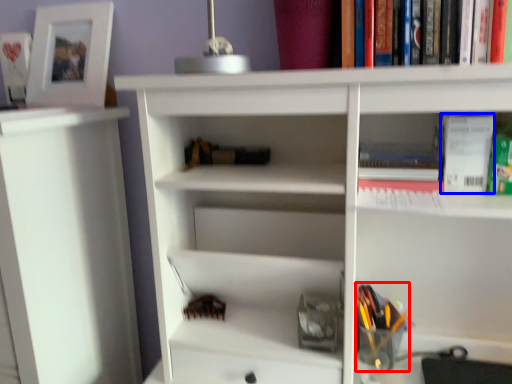
Question: Which object is further to the camera taking this photo, stationery (highlighted by a red box) or paperback book (highlighted by a blue box)?

Choices:
 (A) stationery
 (B) paperback book

Answer: (A)